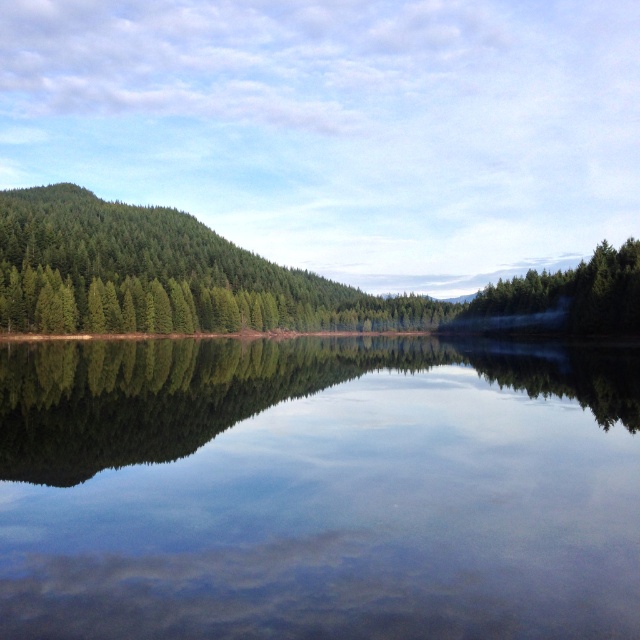
Question: Can you confirm if clear glass lake at center is wider than green matte tree at right?

Choices:
 (A) yes
 (B) no

Answer: (A)

Question: Which is nearer to the clear glass lake at center?

Choices:
 (A) green matte tree at right
 (B) green textured forest at left

Answer: (A)

Question: Among these points, which one is nearest to the camera?

Choices:
 (A) (600, 260)
 (B) (298, 288)
 (C) (496, 605)

Answer: (C)

Question: Observing the image, what is the correct spatial positioning of clear glass lake at center in reference to green textured forest at left?

Choices:
 (A) above
 (B) below

Answer: (B)

Question: Does clear glass lake at center appear under green matte tree at right?

Choices:
 (A) no
 (B) yes

Answer: (B)

Question: Which object is positioned farthest from the green matte tree at right?

Choices:
 (A) clear glass lake at center
 (B) green textured forest at left

Answer: (B)